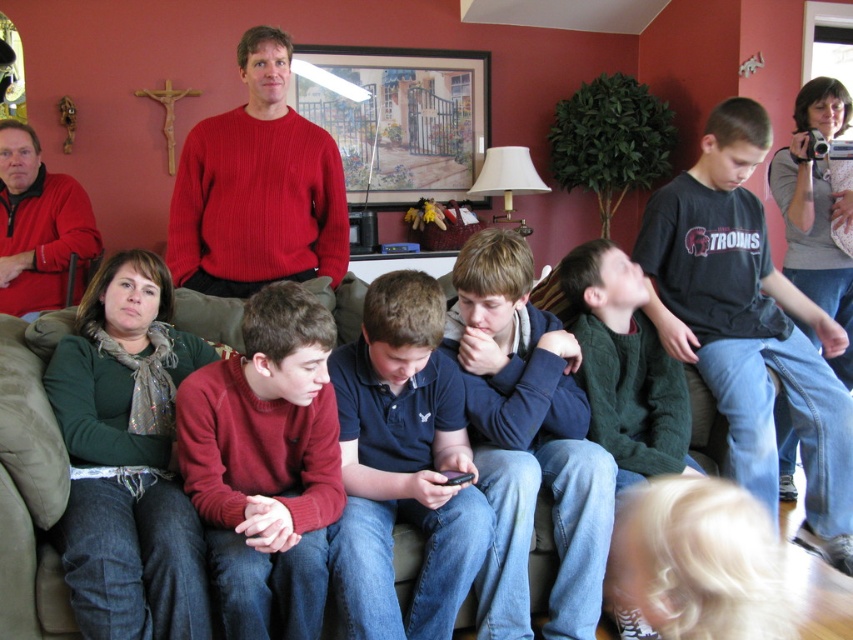
Question: Among these points, which one is nearest to the camera?

Choices:
 (A) (300, 60)
 (B) (39, 461)

Answer: (B)

Question: Does maroon sweater at center appear under dark blue fleece at center?

Choices:
 (A) no
 (B) yes

Answer: (B)

Question: Is dark blue polo shirt at center positioned at the back of green sweater at center?

Choices:
 (A) no
 (B) yes

Answer: (A)

Question: Considering the real-world distances, which object is farthest from the dark blue fleece at center?

Choices:
 (A) matte red sweater at left
 (B) ribbed red sweater at upper center
 (C) dark blue polo shirt at center

Answer: (A)

Question: Considering the real-world distances, which object is farthest from the dark blue fleece at center?

Choices:
 (A) dark blue polo shirt at center
 (B) dark gray cotton shirt at center

Answer: (B)

Question: Is dark blue polo shirt at center to the right of green sweater at center from the viewer's perspective?

Choices:
 (A) yes
 (B) no

Answer: (B)